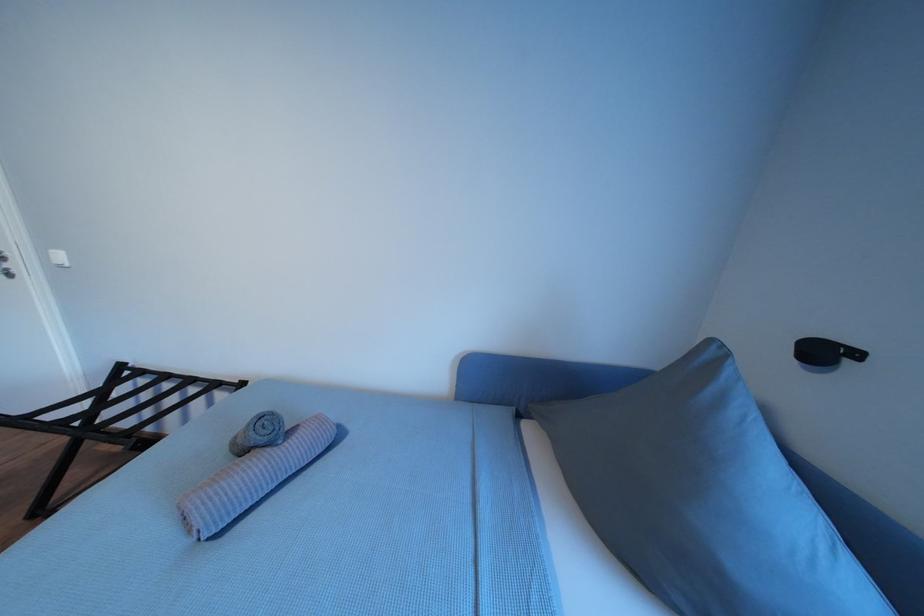
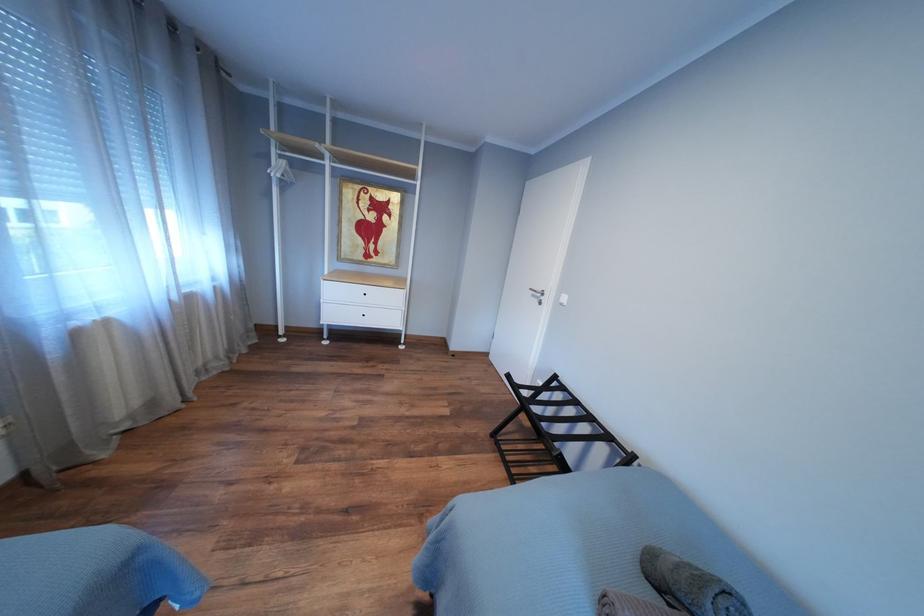
Question: How did the camera likely rotate?

Choices:
 (A) Left
 (B) Right
 (C) Up
 (D) Down

Answer: (A)